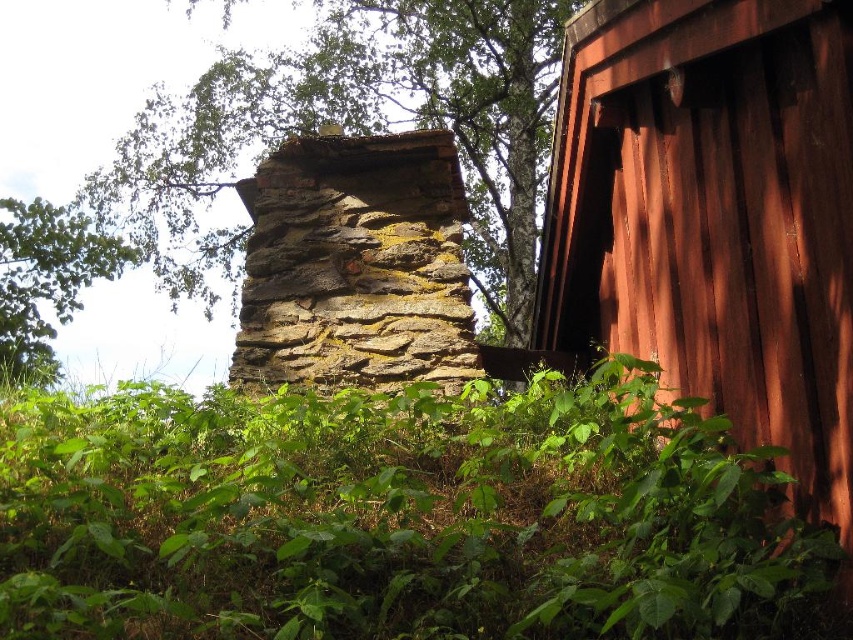
Based on the photo, you are a painter who needs to move a ladder from the rusty wood cabin at right to the weathered stone chimney at center. The ladder is 5 feet long. Can you safely place the ladder between them without it touching the ground?

The distance between the rusty wood cabin at right and the weathered stone chimney at center is 5.36 feet. Since the ladder is 5 feet long, it can be placed between them without touching the ground as the ladder length is shorter than the distance between the two structures.

Looking at this image, you are standing in front of the stone structure and want to walk towards the rusty wood cabin at right. Which direction should you walk to avoid the green leafy tree at upper left?

You should walk to the right of the green leafy tree at upper left because the rusty wood cabin at right is located above it, meaning the tree is positioned lower than the cabin in the scene.

You are standing in front of the stone structure and want to take a photo of both the rusty wood cabin at right and the green mossy stone at center. Since the camera can only focus on one object at a time, which object should you position closer to ensure both are in focus?

You should position the camera closer to the green mossy stone at center because the rusty wood cabin at right is much taller than it. By focusing on the closer object, the depth of field will include both.